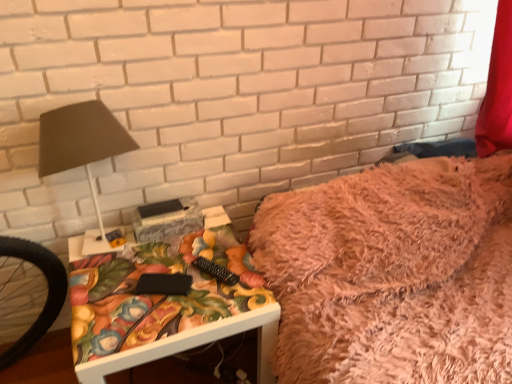
Find the location of a particular element. white glossy table at lower left is located at coordinates (167, 305).

Where is `matte black lamp at left`? Image resolution: width=512 pixels, height=384 pixels. matte black lamp at left is located at coordinates (81, 142).

This screenshot has width=512, height=384. What do you see at coordinates (393, 274) in the screenshot? I see `fuzzy pink blanket at upper right` at bounding box center [393, 274].

Where is `white glossy table at lower left`? white glossy table at lower left is located at coordinates [167, 305].

Considering the relative sizes of matte black lamp at left and white glossy table at lower left in the image provided, is matte black lamp at left wider than white glossy table at lower left?

In fact, matte black lamp at left might be narrower than white glossy table at lower left.

Is matte black lamp at left next to white glossy table at lower left and touching it?

No, matte black lamp at left is not making contact with white glossy table at lower left.

Does matte black lamp at left have a larger size compared to white glossy table at lower left?

Incorrect, matte black lamp at left is not larger than white glossy table at lower left.

Is white glossy table at lower left at the back of matte black lamp at left?

That's not correct — matte black lamp at left is not looking away from white glossy table at lower left.

Considering the positions of objects matte black lamp at left and fuzzy pink blanket at upper right in the image provided, who is more to the left, matte black lamp at left or fuzzy pink blanket at upper right?

matte black lamp at left.

Does matte black lamp at left come behind fuzzy pink blanket at upper right?

No, it is in front of fuzzy pink blanket at upper right.

Is matte black lamp at left inside the boundaries of fuzzy pink blanket at upper right, or outside?

matte black lamp at left is located beyond the bounds of fuzzy pink blanket at upper right.

Considering the relative sizes of matte black lamp at left and fuzzy pink blanket at upper right in the image provided, is matte black lamp at left smaller than fuzzy pink blanket at upper right?

Correct, matte black lamp at left occupies less space than fuzzy pink blanket at upper right.

Considering the relative sizes of fuzzy pink blanket at upper right and matte black lamp at left in the image provided, is fuzzy pink blanket at upper right shorter than matte black lamp at left?

Yes.

Is the depth of fuzzy pink blanket at upper right greater than that of matte black lamp at left?

Yes.

Based on their sizes in the image, would you say fuzzy pink blanket at upper right is bigger or smaller than matte black lamp at left?

fuzzy pink blanket at upper right is bigger than matte black lamp at left.

Can you confirm if fuzzy pink blanket at upper right is positioned to the right of matte black lamp at left?

Yes, fuzzy pink blanket at upper right is to the right of matte black lamp at left.

Are white glossy table at lower left and fuzzy pink blanket at upper right located far from each other?

No, white glossy table at lower left is not far from fuzzy pink blanket at upper right.

Is white glossy table at lower left outside of fuzzy pink blanket at upper right?

Absolutely, white glossy table at lower left is external to fuzzy pink blanket at upper right.

What's the angular difference between white glossy table at lower left and fuzzy pink blanket at upper right's facing directions?

They differ by 0.0445 degrees in their facing directions.

There is a white glossy table at lower left. Where is `furniture above it (from a real-world perspective)`? furniture above it (from a real-world perspective) is located at coordinates (393, 274).

Based on their positions, is white glossy table at lower left located to the left or right of matte black lamp at left?

Clearly, white glossy table at lower left is on the right of matte black lamp at left in the image.

Between white glossy table at lower left and matte black lamp at left, which one has more height?

With more height is matte black lamp at left.

Considering the relative sizes of white glossy table at lower left and matte black lamp at left in the image provided, is white glossy table at lower left thinner than matte black lamp at left?

No.

Which is behind, point (138, 254) or point (127, 132)?

Point (138, 254)

Is fuzzy pink blanket at upper right not close to white glossy table at lower left?

No, fuzzy pink blanket at upper right is in close proximity to white glossy table at lower left.

Between fuzzy pink blanket at upper right and white glossy table at lower left, which one has smaller width?

white glossy table at lower left is thinner.

From a real-world perspective, is fuzzy pink blanket at upper right on white glossy table at lower left?

Correct, in the physical world, fuzzy pink blanket at upper right is higher than white glossy table at lower left.

You are a GUI agent. You are given a task and a screenshot of the screen. Output one action in this format:
    pyautogui.click(x=<x>, y=<y>)
    Task: Click on the table lamp in front of the white glossy table at lower left
    Image resolution: width=512 pixels, height=384 pixels.
    Given the screenshot: What is the action you would take?
    tap(81, 142)

In order to click on furniture that appears behind the matte black lamp at left in this screenshot , I will do `click(393, 274)`.

Estimate the real-world distances between objects in this image. Which object is closer to white glossy table at lower left, matte black lamp at left or fuzzy pink blanket at upper right?

fuzzy pink blanket at upper right is positioned closer to the anchor white glossy table at lower left.

Estimate the real-world distances between objects in this image. Which object is closer to white glossy table at lower left, fuzzy pink blanket at upper right or matte black lamp at left?

Based on the image, fuzzy pink blanket at upper right appears to be nearer to white glossy table at lower left.

Which object lies nearer to the anchor point fuzzy pink blanket at upper right, matte black lamp at left or white glossy table at lower left?

white glossy table at lower left lies closer to fuzzy pink blanket at upper right than the other object.

From the image, which object appears to be nearer to matte black lamp at left, white glossy table at lower left or fuzzy pink blanket at upper right?

white glossy table at lower left.

Which object lies further to the anchor point matte black lamp at left, fuzzy pink blanket at upper right or white glossy table at lower left?

fuzzy pink blanket at upper right is positioned further to the anchor matte black lamp at left.

Based on their spatial positions, is white glossy table at lower left or matte black lamp at left closer to fuzzy pink blanket at upper right?

The object closer to fuzzy pink blanket at upper right is white glossy table at lower left.

This screenshot has width=512, height=384. I want to click on table between matte black lamp at left and fuzzy pink blanket at upper right from left to right, so click(x=167, y=305).